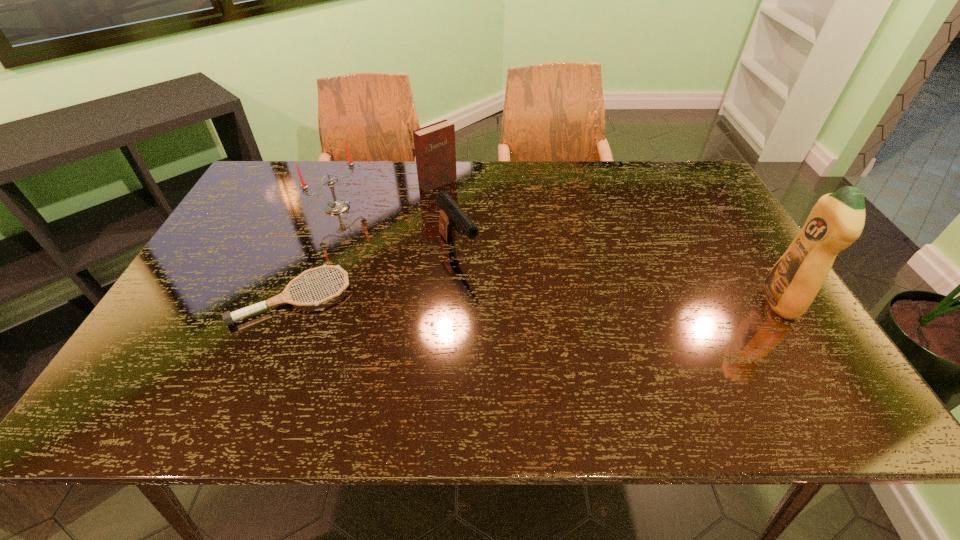
Find the location of `object that is the second closest one to the tallest object`. object that is the second closest one to the tallest object is located at coordinates (435, 152).

This screenshot has width=960, height=540. What are the coordinates of `object that can be found as the third closest to the fourth nearest object` in the screenshot? It's located at (451, 214).

Locate an element on the screen. The image size is (960, 540). vacant space that satisfies the following two spatial constraints: 1. on the front side of the second farthest object; 2. on the label of the tallest object is located at coordinates (300, 301).

This screenshot has height=540, width=960. Find the location of `vacant space that satisfies the following two spatial constraints: 1. on the front side of the candle; 2. on the label of the rightmost object`. vacant space that satisfies the following two spatial constraints: 1. on the front side of the candle; 2. on the label of the rightmost object is located at coordinates (300, 301).

Identify the location of blank space that satisfies the following two spatial constraints: 1. on the front side of the diary; 2. on the label of the detergent. 423,301.

I want to click on free space that satisfies the following two spatial constraints: 1. on the front side of the detergent; 2. on the label of the shortest object, so click(292, 301).

Image resolution: width=960 pixels, height=540 pixels. I want to click on vacant space that satisfies the following two spatial constraints: 1. on the back side of the fourth tallest object; 2. on the left side of the tennis racket, so click(x=312, y=251).

Where is `vacant space that satisfies the following two spatial constraints: 1. on the front side of the fourth nearest object; 2. on the label of the tallest object`? This screenshot has width=960, height=540. vacant space that satisfies the following two spatial constraints: 1. on the front side of the fourth nearest object; 2. on the label of the tallest object is located at coordinates (300, 301).